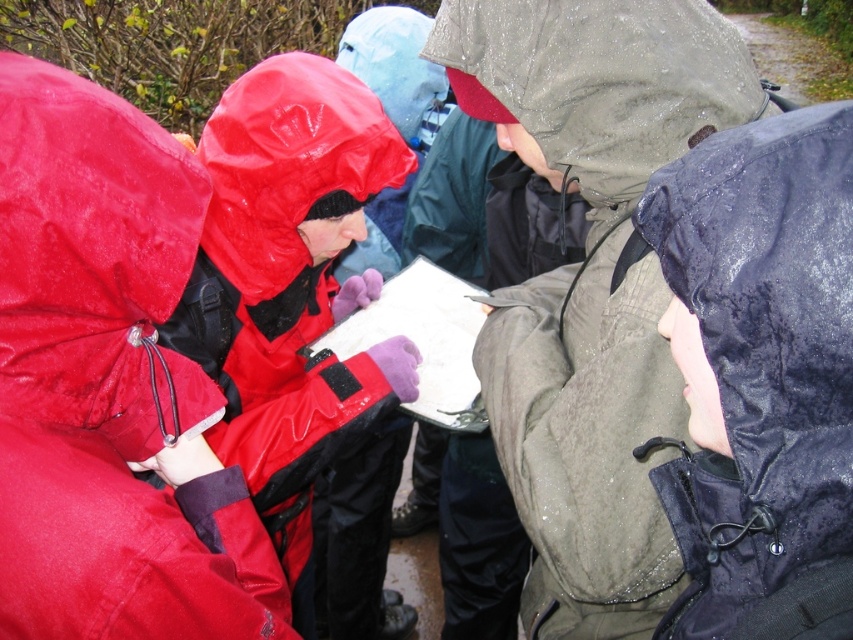
Is the position of shiny red jacket at left more distant than that of rubberized red jacket at left?

That is False.

Is point (32, 417) closer to viewer compared to point (314, 381)?

Yes, point (32, 417) is in front of point (314, 381).

What do you see at coordinates (108, 384) in the screenshot?
I see `shiny red jacket at left` at bounding box center [108, 384].

This screenshot has width=853, height=640. I want to click on shiny red jacket at left, so click(108, 384).

Is point (193, 499) positioned before point (682, 60)?

Yes.

Can you confirm if shiny red jacket at left is positioned to the right of matte green jacket at center?

Incorrect, shiny red jacket at left is not on the right side of matte green jacket at center.

Does point (146, 205) come closer to viewer compared to point (622, 508)?

Yes, point (146, 205) is closer to viewer.

Identify the location of shiny red jacket at left. This screenshot has height=640, width=853. (108, 384).

Can you confirm if matte green jacket at center is wider than shiny dark blue jacket at lower right?

Indeed, matte green jacket at center has a greater width compared to shiny dark blue jacket at lower right.

Which is more to the right, matte green jacket at center or shiny dark blue jacket at lower right?

shiny dark blue jacket at lower right

Does point (476, 360) come in front of point (804, 346)?

No, it is behind (804, 346).

Where is `matte green jacket at center`? Image resolution: width=853 pixels, height=640 pixels. matte green jacket at center is located at coordinates (592, 284).